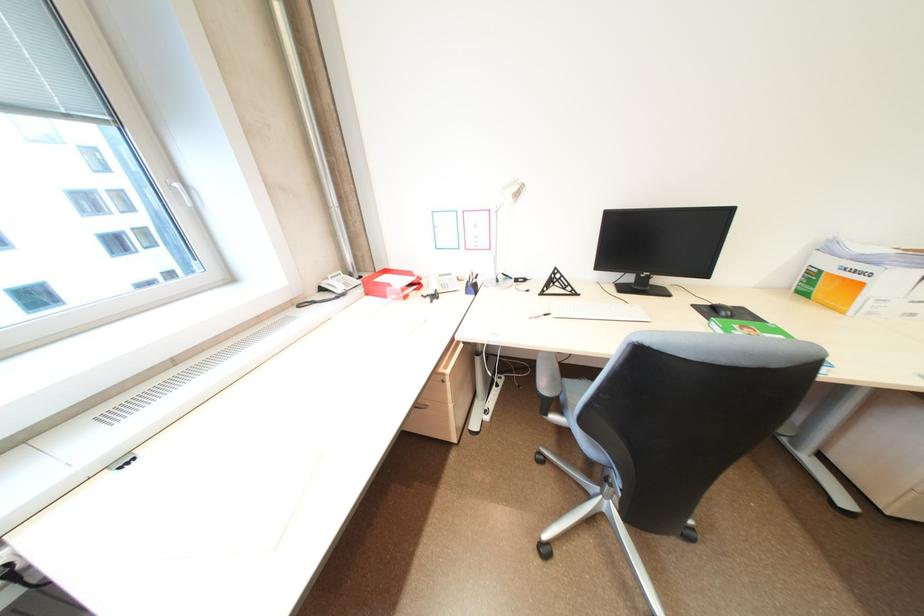
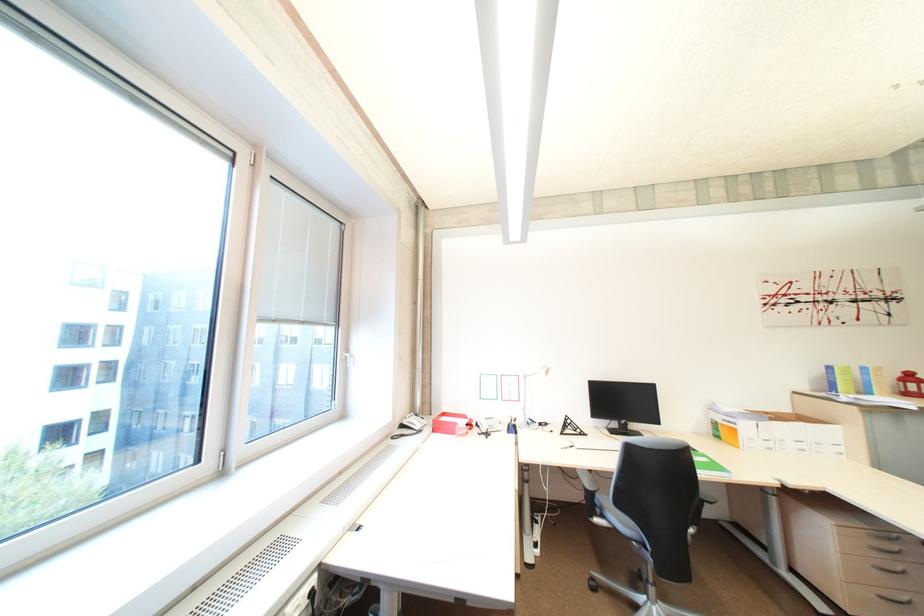
The point at (331,290) is marked in the first image. Where is the corresponding point in the second image?

(410, 427)